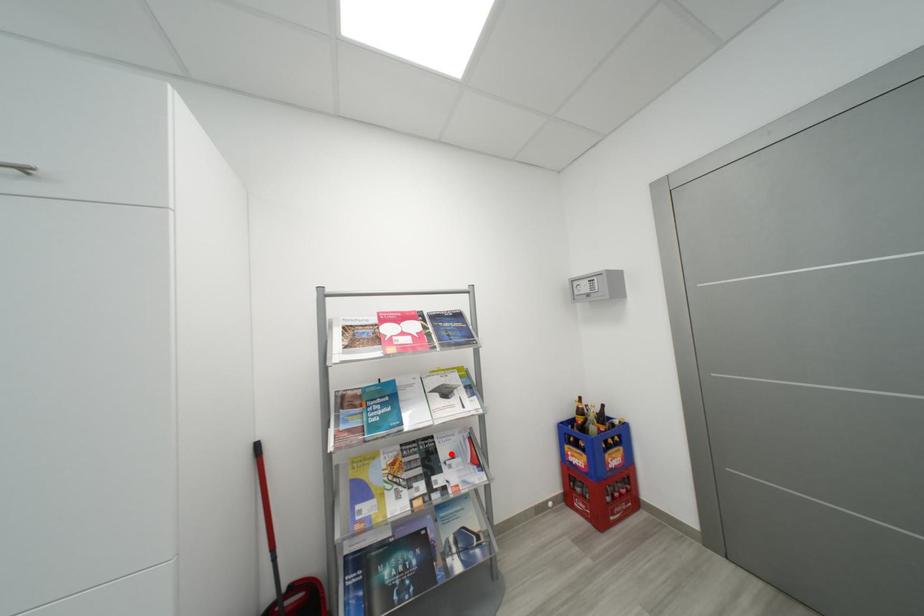
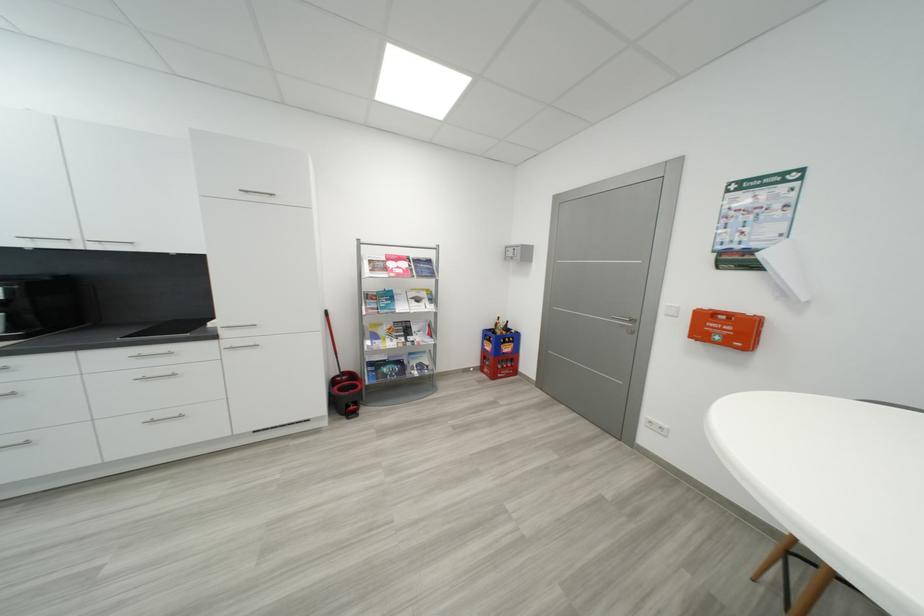
Find the pixel in the second image that matches the highlighted location in the first image.

(421, 330)